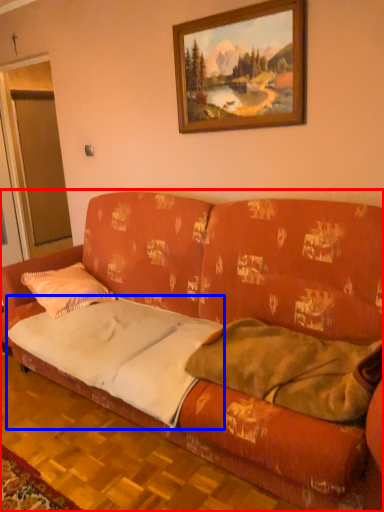
Question: Which of the following is the closest to the observer, studio couch (highlighted by a red box) or sheet (highlighted by a blue box)?

Choices:
 (A) studio couch
 (B) sheet

Answer: (A)